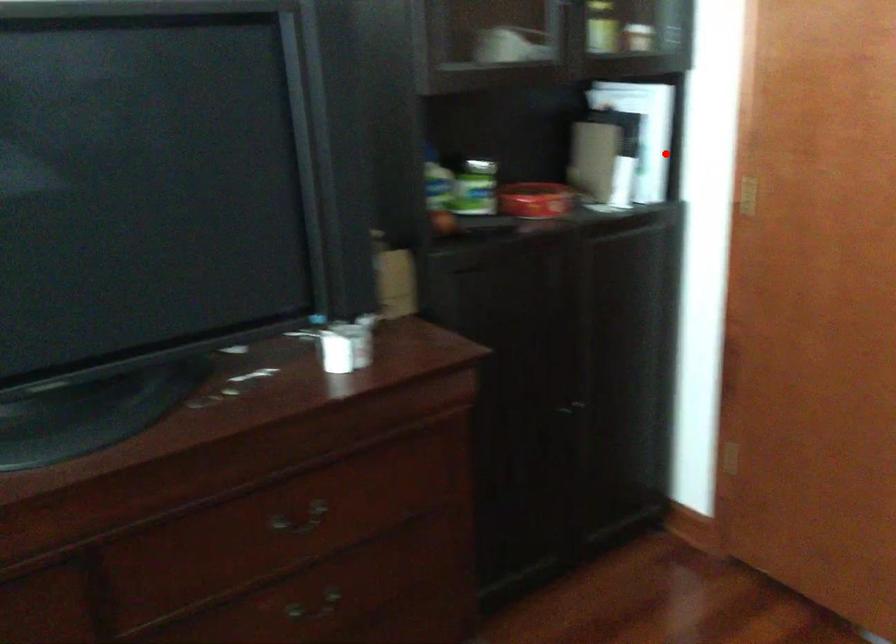
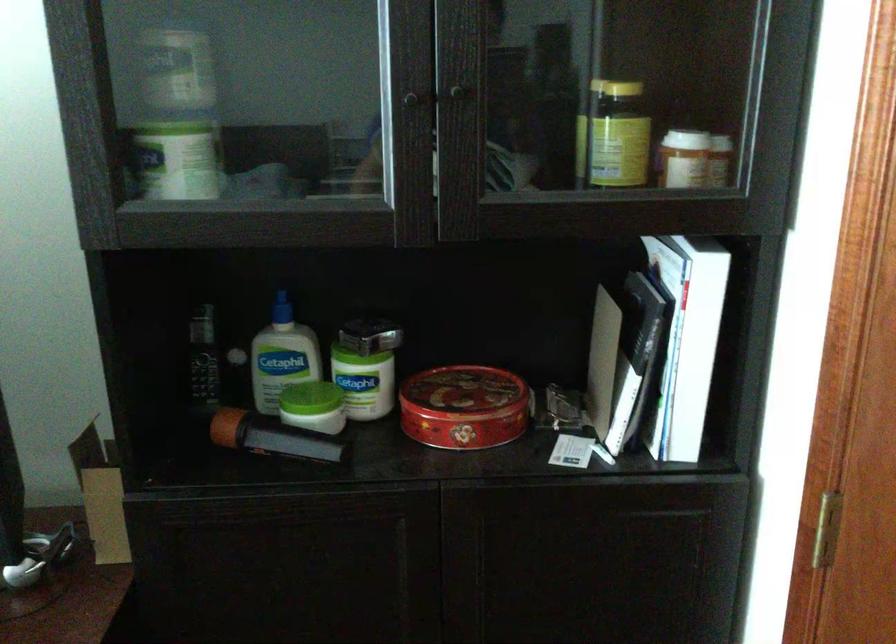
Locate, in the second image, the point that corresponds to the highlighted location in the first image.

(728, 373)